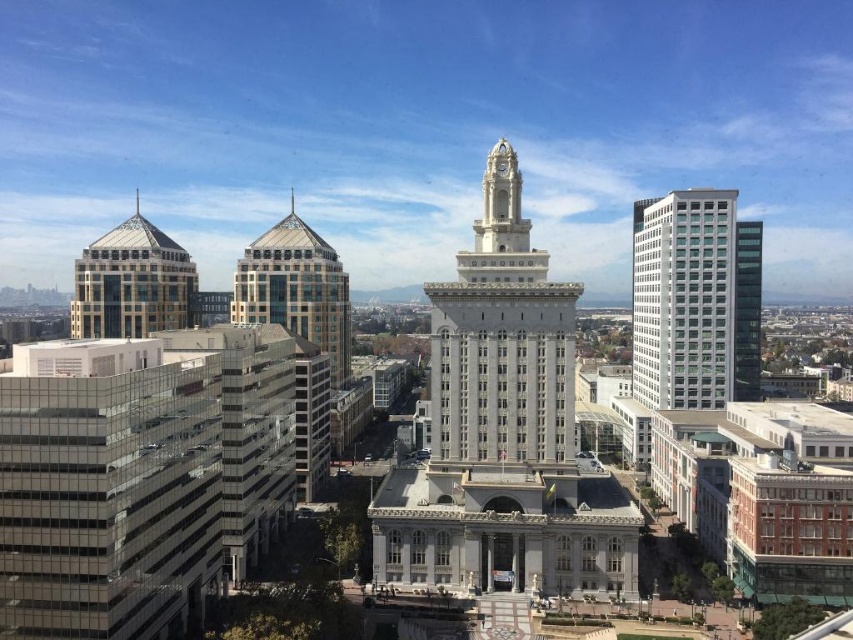
You are a city planner reviewing the city layout. The central historic building with its clock tower is crucial for maintaining the city heritage. You need to ensure that any new construction around it doesn not block the view of the clock tower from the central square. Given the coordinates of the white stone clock tower at center, can you confirm if a proposed skyscraper at coordinates point A would block the view?

The white stone clock tower at center is located at point [502,339]. If the proposed skyscraper at point A is positioned in a direction that aligns between the central square and the clock tower coordinates, it could potentially block the view. To determine this accurately, the exact coordinates of point A and the elevation of the skyscraper would need to be compared with the line of sight from the central square to the clock tower location.

You are standing in the city square looking at the historic building. You notice a specific point marked at coordinates [451,392]. If you want to place a 1.7 meter tall statue exactly at that point, will the statue be visible from where you are standing?

The point at coordinates [451,392] is 115.15 meters away from the viewer. Since the statue is only 1.7 meters tall, it will likely be visible from that distance as long as there are no obstructions between the viewer and the point. However, the description does not mention any obstacles, so based on the given information, the statue would be visible.